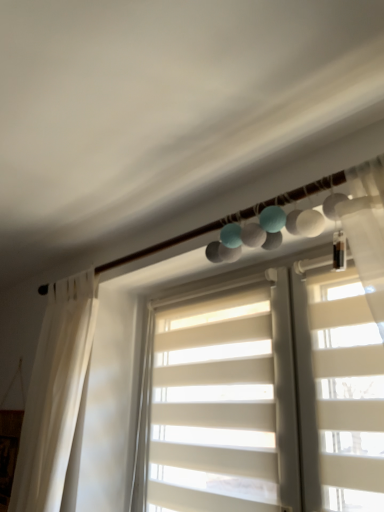
Question: Should I look upward or downward to see white matte/soft shutter at center?

Choices:
 (A) down
 (B) up

Answer: (A)